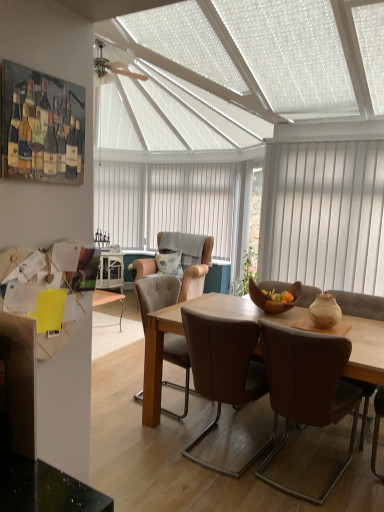
Question: From a real-world perspective, does leather armchair at center, arranged as the 1th chair when viewed from the back, sit lower than brown leather chair at center, positioned as the 1th chair in front-to-back order?

Choices:
 (A) yes
 (B) no

Answer: (B)

Question: From the image's perspective, is leather armchair at center, which is counted as the fourth chair, starting from the front, located above brown leather chair at center, the fourth chair in the back-to-front sequence?

Choices:
 (A) yes
 (B) no

Answer: (A)

Question: Considering the relative sizes of leather armchair at center, arranged as the 1th chair when viewed from the back, and brown leather chair at center, positioned as the 1th chair in front-to-back order, in the image provided, is leather armchair at center, arranged as the 1th chair when viewed from the back, wider than brown leather chair at center, positioned as the 1th chair in front-to-back order,?

Choices:
 (A) yes
 (B) no

Answer: (A)

Question: Can you confirm if leather armchair at center, arranged as the 1th chair when viewed from the back, is shorter than brown leather chair at center, positioned as the 1th chair in front-to-back order?

Choices:
 (A) no
 (B) yes

Answer: (A)

Question: Is leather armchair at center, which is counted as the fourth chair, starting from the front, surrounding brown leather chair at center, positioned as the 1th chair in front-to-back order?

Choices:
 (A) yes
 (B) no

Answer: (B)

Question: Is white vertical blinds at center spatially inside brown leather chair at center, which is counted as the 3th chair, starting from the front, or outside of it?

Choices:
 (A) inside
 (B) outside

Answer: (B)

Question: From their relative heights in the image, would you say white vertical blinds at center is taller or shorter than brown leather chair at center, the 2th chair viewed from the back?

Choices:
 (A) tall
 (B) short

Answer: (A)

Question: In the image, is white vertical blinds at center on the left side or the right side of brown leather chair at center, which is counted as the 3th chair, starting from the front?

Choices:
 (A) right
 (B) left

Answer: (A)

Question: From a real-world perspective, is white vertical blinds at center above or below brown leather chair at center, which is counted as the 3th chair, starting from the front?

Choices:
 (A) above
 (B) below

Answer: (A)

Question: In the image, is matte beige vase at right positioned in front of or behind brown leather chair at center, the fourth chair in the back-to-front sequence?

Choices:
 (A) front
 (B) behind

Answer: (B)

Question: Considering the positions of matte beige vase at right and brown leather chair at center, positioned as the 1th chair in front-to-back order, in the image, is matte beige vase at right wider or thinner than brown leather chair at center, positioned as the 1th chair in front-to-back order,?

Choices:
 (A) thin
 (B) wide

Answer: (A)

Question: In terms of height, does matte beige vase at right look taller or shorter compared to brown leather chair at center, the fourth chair in the back-to-front sequence?

Choices:
 (A) tall
 (B) short

Answer: (B)

Question: Based on their positions, is matte beige vase at right located to the left or right of brown leather chair at center, the fourth chair in the back-to-front sequence?

Choices:
 (A) right
 (B) left

Answer: (A)

Question: In the image, is white wood blinds at right positioned in front of or behind fluffy fabric pillow at center?

Choices:
 (A) front
 (B) behind

Answer: (A)

Question: From the image's perspective, relative to fluffy fabric pillow at center, is white wood blinds at right above or below?

Choices:
 (A) above
 (B) below

Answer: (A)